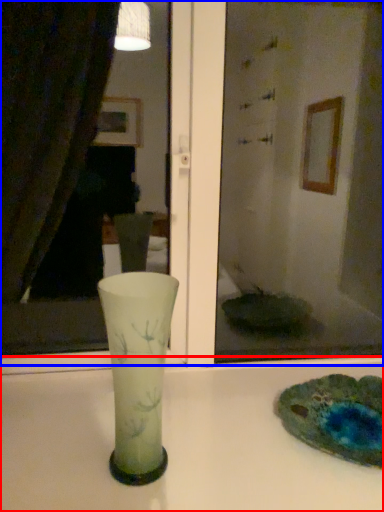
Question: Which object appears closest to the camera in this image, counter top (highlighted by a red box) or mirror (highlighted by a blue box)?

Choices:
 (A) counter top
 (B) mirror

Answer: (A)